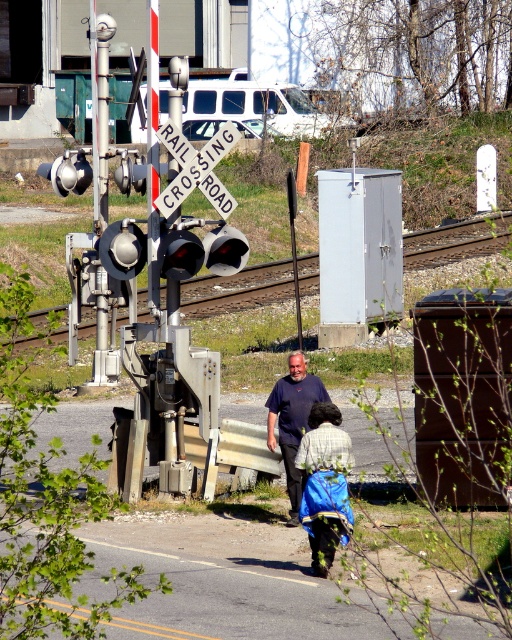
Looking at this image, which of these two, metal train track at left or white wooden railroad crossing sign at center, stands taller?

metal train track at left is taller.

Find the location of a particular element. metal train track at left is located at coordinates (456, 241).

Find the location of a particular element. Image resolution: width=512 pixels, height=640 pixels. metal train track at left is located at coordinates (456, 241).

Is blue fabric baby carriage at center shorter than dark blue t-shirt at center?

Yes.

Identify the location of blue fabric baby carriage at center. The image size is (512, 640). (325, 484).

Who is more distant from viewer, (206,292) or (304,515)?

The point (206,292) is behind.

What do you see at coordinates (456, 241) in the screenshot? I see `metal train track at left` at bounding box center [456, 241].

What do you see at coordinates (456, 241) in the screenshot?
I see `metal train track at left` at bounding box center [456, 241].

Locate an element on the screen. This screenshot has height=640, width=512. metal train track at left is located at coordinates (456, 241).